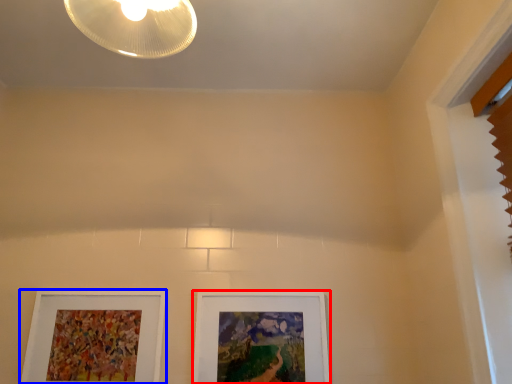
Question: Which object appears farthest to the camera in this image, picture frame (highlighted by a red box) or picture frame (highlighted by a blue box)?

Choices:
 (A) picture frame
 (B) picture frame

Answer: (A)